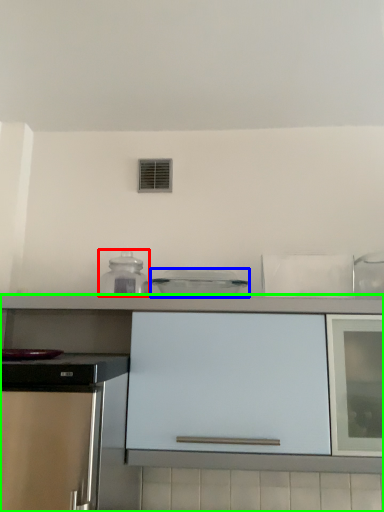
Question: Based on their relative distances, which object is nearer to kitchen appliance (highlighted by a red box)? Choose from kitchen appliance (highlighted by a blue box) and cabinetry (highlighted by a green box).

Choices:
 (A) kitchen appliance
 (B) cabinetry

Answer: (A)